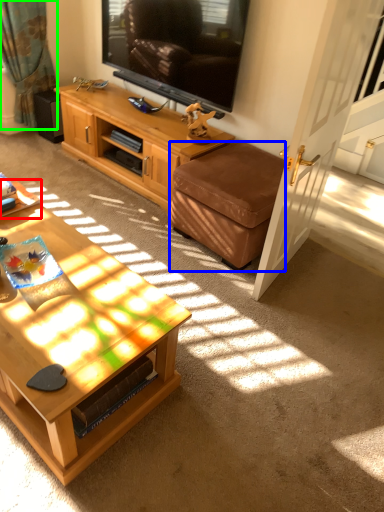
Question: Considering the real-world distances, which object is farthest from desk (highlighted by a red box)? ottoman (highlighted by a blue box) or curtain (highlighted by a green box)?

Choices:
 (A) ottoman
 (B) curtain

Answer: (B)